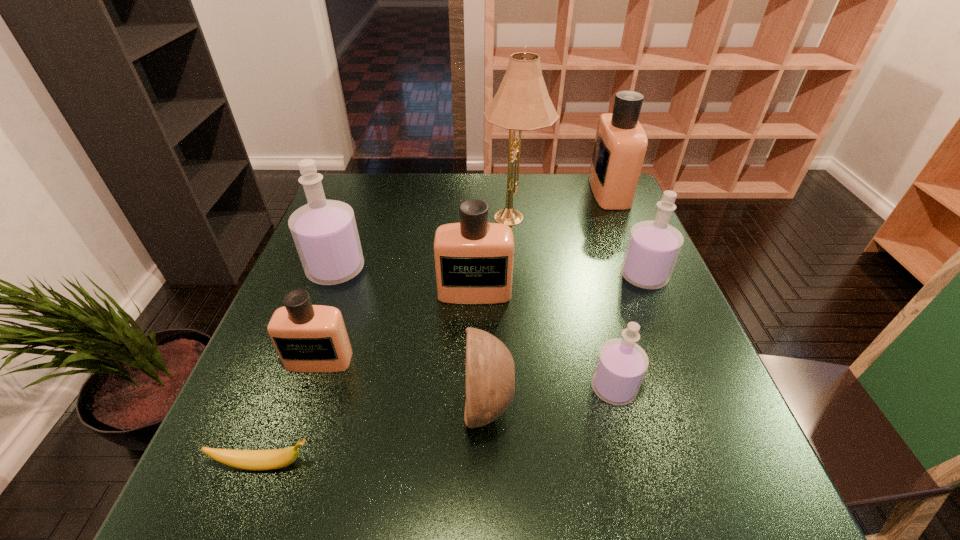
Image resolution: width=960 pixels, height=540 pixels. I want to click on the tallest object, so click(x=522, y=102).

At what (x,y) coordinates should I click in order to perform the action: click on lampshade. Please return your answer as a coordinate pair (x, y). This screenshot has width=960, height=540. Looking at the image, I should click on (522, 102).

You are a GUI agent. You are given a task and a screenshot of the screen. Output one action in this format:
    pyautogui.click(x=<x>, y=<y>)
    Task: Click on the farthest perfume
    This screenshot has height=540, width=960.
    Given the screenshot: What is the action you would take?
    pyautogui.click(x=620, y=146)

The width and height of the screenshot is (960, 540). I want to click on the farthest beige perfume, so click(x=620, y=146).

Identify the location of the leftmost purple perfume. (325, 234).

Find the location of `the second smallest purple perfume`. the second smallest purple perfume is located at coordinates (653, 247).

This screenshot has height=540, width=960. Identify the location of the second farthest beige perfume. (474, 259).

Identify the location of the second biggest beige perfume. (474, 259).

Image resolution: width=960 pixels, height=540 pixels. I want to click on the nearest purple perfume, so (621, 364).

The width and height of the screenshot is (960, 540). Identify the location of the second purple perfume from left to right. (621, 364).